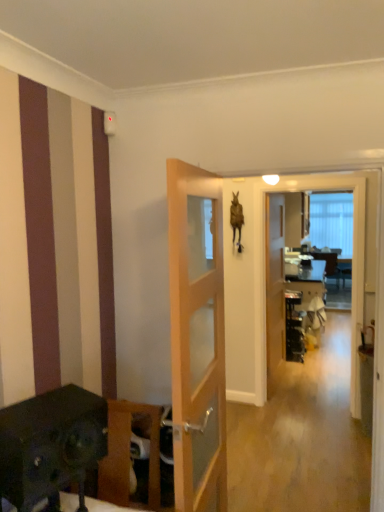
Where is `vacant space underneath wooden door at center, positioned as the 2th door in front-to-back order (from a real-world perspective)`? The image size is (384, 512). vacant space underneath wooden door at center, positioned as the 2th door in front-to-back order (from a real-world perspective) is located at coordinates (283, 383).